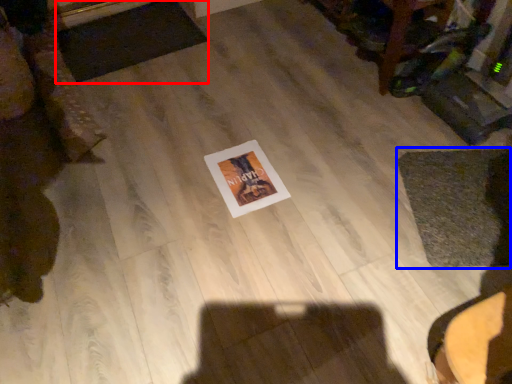
Question: Among these objects, which one is farthest to the camera, mat (highlighted by a red box) or mat (highlighted by a blue box)?

Choices:
 (A) mat
 (B) mat

Answer: (A)